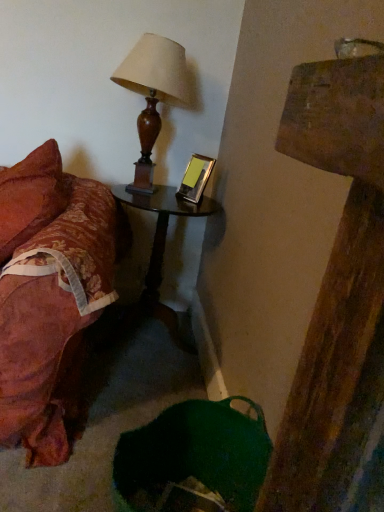
Question: Is wooden lampshade at upper left wider than black glossy nightstand at center?

Choices:
 (A) yes
 (B) no

Answer: (B)

Question: Could you tell me if wooden lampshade at upper left is turned towards black glossy nightstand at center?

Choices:
 (A) no
 (B) yes

Answer: (A)

Question: Is wooden lampshade at upper left bigger than black glossy nightstand at center?

Choices:
 (A) yes
 (B) no

Answer: (B)

Question: Is wooden lampshade at upper left not near black glossy nightstand at center?

Choices:
 (A) yes
 (B) no

Answer: (B)

Question: Is black glossy nightstand at center inside wooden lampshade at upper left?

Choices:
 (A) yes
 (B) no

Answer: (B)

Question: Is wooden lampshade at upper left not within black glossy nightstand at center?

Choices:
 (A) no
 (B) yes

Answer: (B)

Question: Is wooden lampshade at upper left thinner than metallic silver picture frame at upper right?

Choices:
 (A) no
 (B) yes

Answer: (A)

Question: Considering the relative positions of wooden lampshade at upper left and metallic silver picture frame at upper right in the image provided, is wooden lampshade at upper left to the left of metallic silver picture frame at upper right from the viewer's perspective?

Choices:
 (A) yes
 (B) no

Answer: (A)

Question: Is wooden lampshade at upper left shorter than metallic silver picture frame at upper right?

Choices:
 (A) no
 (B) yes

Answer: (A)

Question: From the image's perspective, is wooden lampshade at upper left located above metallic silver picture frame at upper right?

Choices:
 (A) no
 (B) yes

Answer: (B)

Question: Considering the relative sizes of wooden lampshade at upper left and metallic silver picture frame at upper right in the image provided, is wooden lampshade at upper left bigger than metallic silver picture frame at upper right?

Choices:
 (A) yes
 (B) no

Answer: (A)

Question: Is wooden lampshade at upper left facing away from metallic silver picture frame at upper right?

Choices:
 (A) yes
 (B) no

Answer: (B)

Question: Is black glossy nightstand at center further to the viewer compared to metallic silver picture frame at upper right?

Choices:
 (A) yes
 (B) no

Answer: (B)